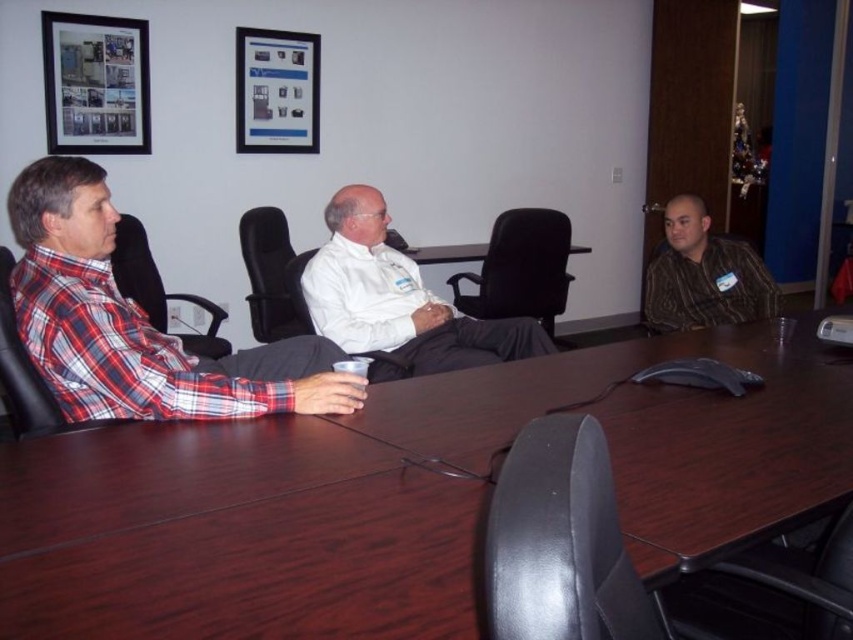
Question: Is metallic photo frame at upper left smaller than matte black picture frame at upper center?

Choices:
 (A) no
 (B) yes

Answer: (B)

Question: Can you confirm if white matte shirt at center is thinner than metallic photo frame at upper left?

Choices:
 (A) yes
 (B) no

Answer: (B)

Question: Which object is positioned closest to the brown wood table at center?

Choices:
 (A) plaid fabric shirt at left
 (B) white matte shirt at center
 (C) matte black picture frame at upper center

Answer: (A)

Question: Which is farther from the brown wood table at center?

Choices:
 (A) striped brown shirt at right
 (B) matte black picture frame at upper center

Answer: (B)

Question: Considering the real-world distances, which object is farthest from the matte black picture frame at upper center?

Choices:
 (A) brown wood table at center
 (B) striped brown shirt at right

Answer: (A)

Question: Where is brown wood table at center located in relation to striped brown shirt at right in the image?

Choices:
 (A) left
 (B) right

Answer: (A)